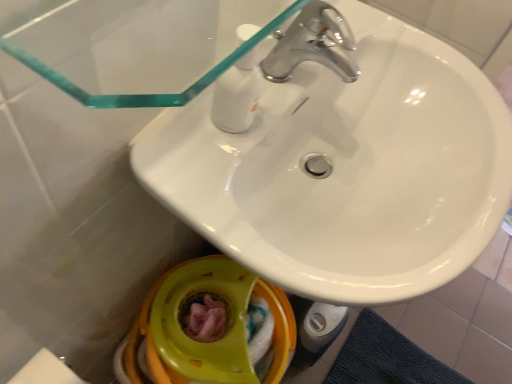
Question: Is chrome metallic faucet at upper center, the second tap from the top, taller or shorter than white glossy sink at upper center?

Choices:
 (A) tall
 (B) short

Answer: (B)

Question: From a real-world perspective, is chrome metallic faucet at upper center, the second tap from the top, physically located above or below white glossy sink at upper center?

Choices:
 (A) above
 (B) below

Answer: (A)

Question: Estimate the real-world distances between objects in this image. Which object is farther from the matte yellow plastic toilet bowl at lower center?

Choices:
 (A) white glossy sink at upper center
 (B) chrome metallic faucet at upper center, the second tap from the top
 (C) chrome metallic faucet at upper center, arranged as the 2th tap when ordered from the bottom

Answer: (C)

Question: Which object is positioned farthest from the white glossy sink at upper center?

Choices:
 (A) matte yellow plastic toilet bowl at lower center
 (B) chrome metallic faucet at upper center, the second tap from the top
 (C) chrome metallic faucet at upper center, arranged as the 2th tap when ordered from the bottom

Answer: (A)